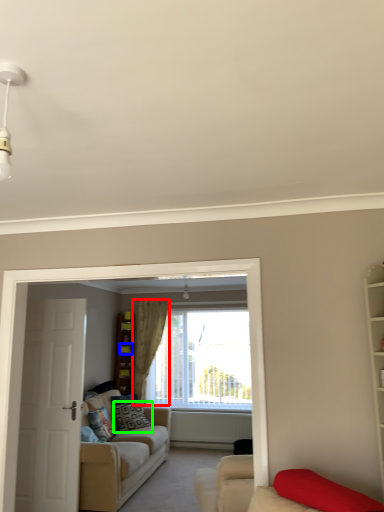
Question: Considering the real-world distances, which object is farthest from curtain (highlighted by a red box)? shelf (highlighted by a blue box) or pillow (highlighted by a green box)?

Choices:
 (A) shelf
 (B) pillow

Answer: (B)